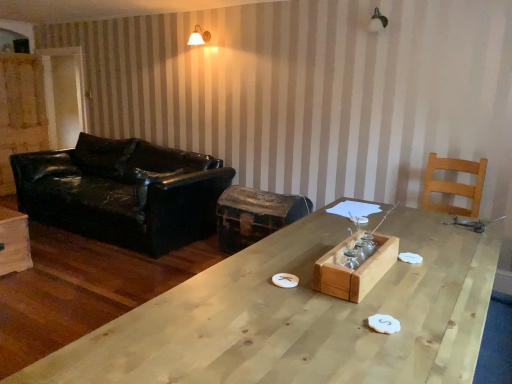
Where is `free space to the left of wooden tray at center`? Image resolution: width=512 pixels, height=384 pixels. free space to the left of wooden tray at center is located at coordinates (271, 274).